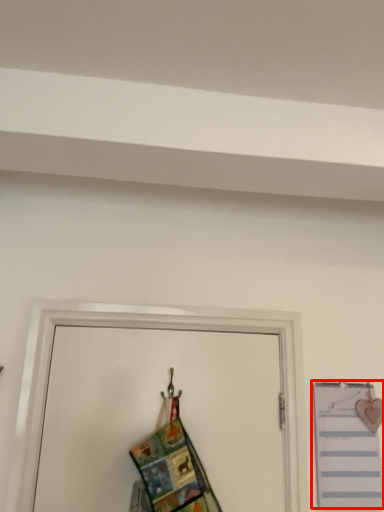
Question: From the image's perspective, where is notebook (annotated by the red box) located relative to fancy dress?

Choices:
 (A) above
 (B) below

Answer: (B)